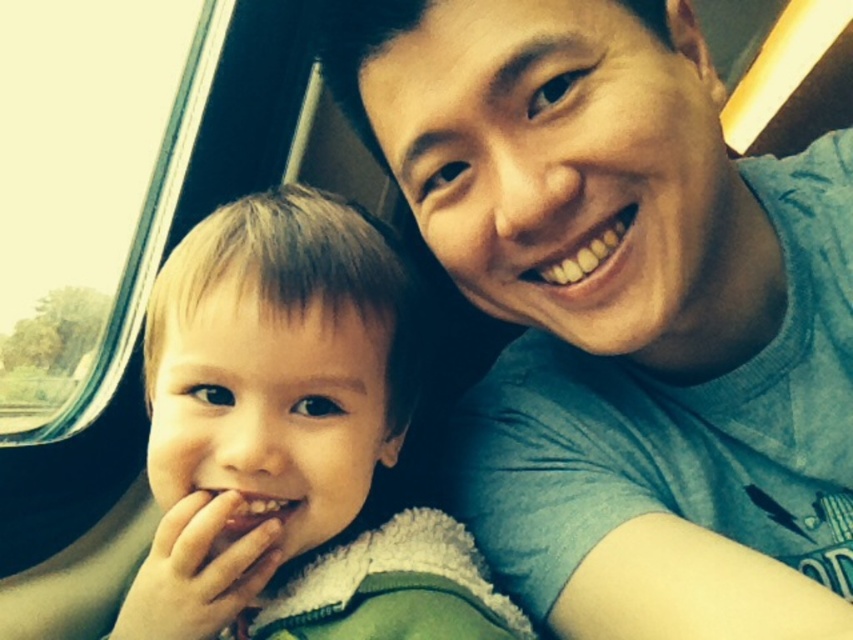
Which is more to the right, blue cotton shirt at upper right or light brown fuzzy jacket at left?

blue cotton shirt at upper right

Is point (720, 232) closer to camera compared to point (410, 369)?

No, it is behind (410, 369).

In order to click on blue cotton shirt at upper right in this screenshot , I will do `click(624, 310)`.

You are a GUI agent. You are given a task and a screenshot of the screen. Output one action in this format:
    pyautogui.click(x=<x>, y=<y>)
    Task: Click on the blue cotton shirt at upper right
    This screenshot has width=853, height=640.
    Given the screenshot: What is the action you would take?
    pyautogui.click(x=624, y=310)